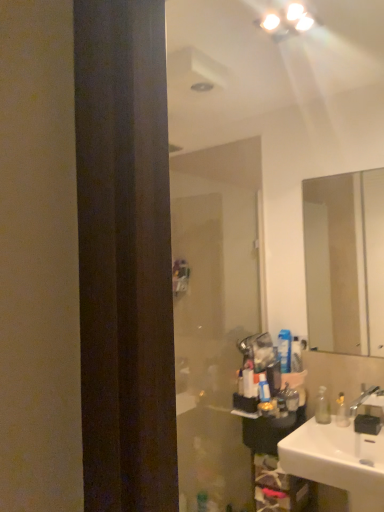
Question: Does transparent plastic bottle at right appear on the left side of silver metallic faucet at lower right?

Choices:
 (A) no
 (B) yes

Answer: (B)

Question: Is transparent plastic bottle at right positioned behind silver metallic faucet at lower right?

Choices:
 (A) no
 (B) yes

Answer: (B)

Question: Is transparent plastic bottle at right thinner than silver metallic faucet at lower right?

Choices:
 (A) yes
 (B) no

Answer: (A)

Question: Does transparent plastic bottle at right appear on the right side of silver metallic faucet at lower right?

Choices:
 (A) yes
 (B) no

Answer: (B)

Question: Does transparent plastic bottle at right have a greater width compared to silver metallic faucet at lower right?

Choices:
 (A) yes
 (B) no

Answer: (B)

Question: Considering their positions, is white plastic toothpaste tube at right, acting as the 2th toiletry starting from the right, located in front of or behind silver metallic faucet at lower right?

Choices:
 (A) behind
 (B) front

Answer: (A)

Question: Does point (286, 330) appear closer or farther from the camera than point (382, 393)?

Choices:
 (A) closer
 (B) farther

Answer: (B)

Question: Considering the positions of white plastic toothpaste tube at right, acting as the 2th toiletry starting from the right, and silver metallic faucet at lower right in the image, is white plastic toothpaste tube at right, acting as the 2th toiletry starting from the right, bigger or smaller than silver metallic faucet at lower right?

Choices:
 (A) big
 (B) small

Answer: (B)

Question: Looking at their shapes, would you say white plastic toothpaste tube at right, positioned as the 2th toiletry in left-to-right order, is wider or thinner than silver metallic faucet at lower right?

Choices:
 (A) thin
 (B) wide

Answer: (A)

Question: Is point (345, 346) positioned closer to the camera than point (362, 399)?

Choices:
 (A) farther
 (B) closer

Answer: (A)

Question: Do you think clear glass mirror at upper right is within silver metallic faucet at lower right, or outside of it?

Choices:
 (A) outside
 (B) inside

Answer: (A)

Question: Is clear glass mirror at upper right in front of or behind silver metallic faucet at lower right in the image?

Choices:
 (A) behind
 (B) front

Answer: (A)

Question: In terms of width, does clear glass mirror at upper right look wider or thinner when compared to silver metallic faucet at lower right?

Choices:
 (A) thin
 (B) wide

Answer: (A)

Question: Considering their positions, is white glossy toothpaste tube at upper right, which ranks as the second toiletry in back-to-front order, located in front of or behind translucent plastic bottle at center, which is counted as the third toiletry, starting from the back?

Choices:
 (A) front
 (B) behind

Answer: (B)

Question: In the image, is white glossy toothpaste tube at upper right, which appears as the 3th toiletry when viewed from the left, on the left side or the right side of translucent plastic bottle at center, which ranks as the third toiletry in right-to-left order?

Choices:
 (A) left
 (B) right

Answer: (B)